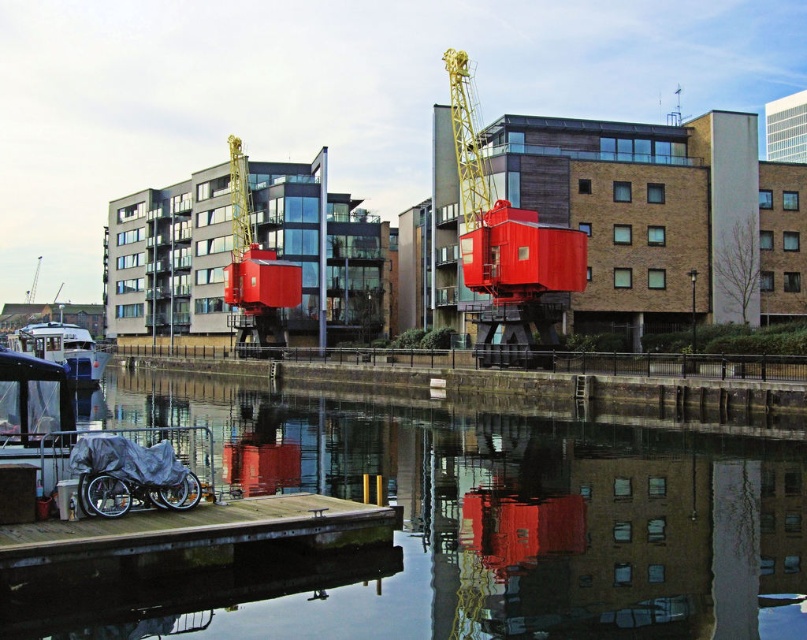
Question: Which point is closer to the camera taking this photo?

Choices:
 (A) (72, 323)
 (B) (312, 502)
 (C) (801, 604)

Answer: (C)

Question: Which object is the closest to the smooth concrete dock at center?

Choices:
 (A) smooth concrete dock at lower left
 (B) wooden dock at lower left
 (C) white glossy boat at lower left

Answer: (A)

Question: Can you confirm if smooth concrete dock at center is smaller than wooden dock at lower left?

Choices:
 (A) no
 (B) yes

Answer: (A)

Question: Can you confirm if smooth concrete dock at lower left is smaller than smooth concrete dock at center?

Choices:
 (A) no
 (B) yes

Answer: (B)

Question: Is smooth concrete dock at center thinner than wooden dock at lower left?

Choices:
 (A) yes
 (B) no

Answer: (B)

Question: Among these objects, which one is farthest from the camera?

Choices:
 (A) wooden dock at lower left
 (B) smooth concrete dock at center

Answer: (B)